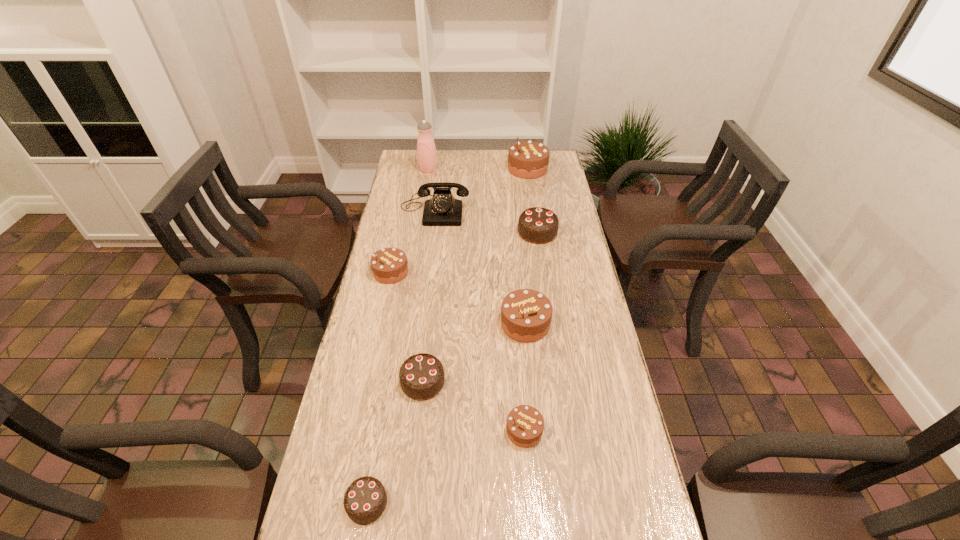
Find the location of a particular element. vacant space that satisfies the following two spatial constraints: 1. on the back side of the farthest chocolate cake; 2. on the left side of the leftmost brown chocolate cake is located at coordinates (413, 169).

In order to click on free location that satisfies the following two spatial constraints: 1. on the back side of the smallest brown chocolate cake; 2. on the left side of the nearest object in this screenshot , I will do `click(379, 430)`.